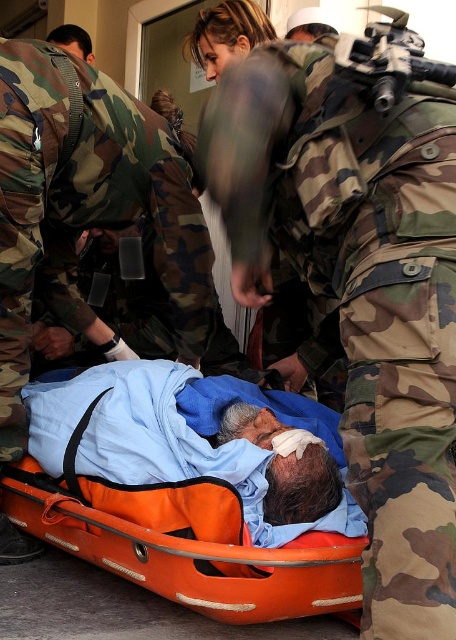
Is camo uniform at center closer to the viewer compared to orange plastic stretcher at center?

Yes, it is.

This screenshot has width=456, height=640. Describe the element at coordinates (358, 288) in the screenshot. I see `camo uniform at center` at that location.

Where is `camo uniform at center`? camo uniform at center is located at coordinates (358, 288).

In order to click on camo uniform at center in this screenshot , I will do `click(358, 288)`.